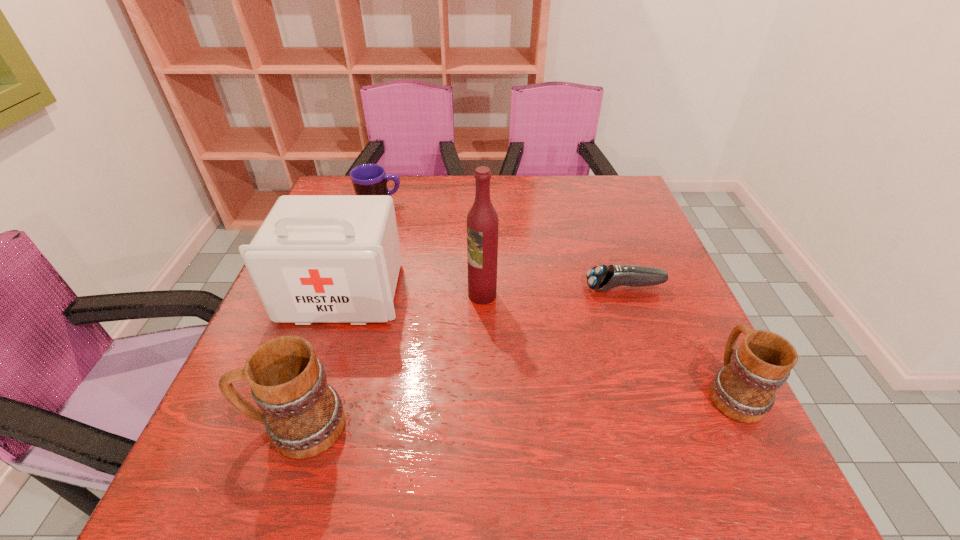
Identify the location of the tallest mug. (303, 415).

Find the location of a particular element. The image size is (960, 540). the rightmost mug is located at coordinates click(744, 389).

You are a GUI agent. You are given a task and a screenshot of the screen. Output one action in this format:
    pyautogui.click(x=<x>, y=<y>)
    Task: Click on the fourth tallest object
    The width and height of the screenshot is (960, 540).
    Given the screenshot: What is the action you would take?
    pyautogui.click(x=744, y=389)

At what (x,y) coordinates should I click in order to perform the action: click on the shortest mug. Please return your answer as a coordinate pair (x, y). Looking at the image, I should click on pos(368,179).

Locate an element on the screen. The image size is (960, 540). the farthest mug is located at coordinates (368, 179).

Locate an element on the screen. Image resolution: width=960 pixels, height=540 pixels. the first-aid kit is located at coordinates (316, 258).

You are a GUI agent. You are given a task and a screenshot of the screen. Output one action in this format:
    pyautogui.click(x=<x>, y=<y>)
    Task: Click on the shortest object
    
    Given the screenshot: What is the action you would take?
    pyautogui.click(x=602, y=278)

This screenshot has height=540, width=960. Identify the location of the fourth object from left to right. (482, 221).

Where is `the tallest object`? This screenshot has width=960, height=540. the tallest object is located at coordinates (482, 221).

Where is `vacant space situated on the side of the rightmost mug with the handle`? This screenshot has width=960, height=540. vacant space situated on the side of the rightmost mug with the handle is located at coordinates (660, 246).